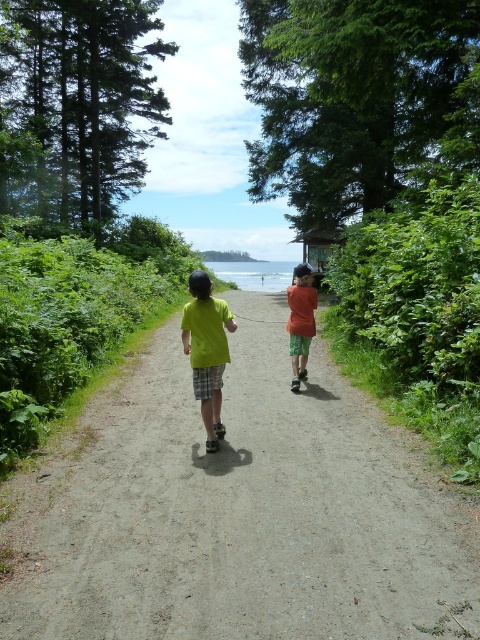
Question: Is dirt path at center closer to camera compared to orange cotton shirt at center?

Choices:
 (A) no
 (B) yes

Answer: (B)

Question: Among these objects, which one is farthest from the camera?

Choices:
 (A) neon green t-shirt at center
 (B) dirt path at center
 (C) orange cotton shirt at center

Answer: (C)

Question: Among these objects, which one is farthest from the camera?

Choices:
 (A) dirt path at center
 (B) orange cotton shirt at center
 (C) neon green t-shirt at center

Answer: (B)

Question: Is dirt path at center wider than orange cotton shirt at center?

Choices:
 (A) no
 (B) yes

Answer: (B)

Question: Which of the following is the farthest from the observer?

Choices:
 (A) neon green t-shirt at center
 (B) orange cotton shirt at center
 (C) dirt path at center

Answer: (B)

Question: Observing the image, what is the correct spatial positioning of neon green t-shirt at center in reference to orange cotton shirt at center?

Choices:
 (A) below
 (B) above

Answer: (A)